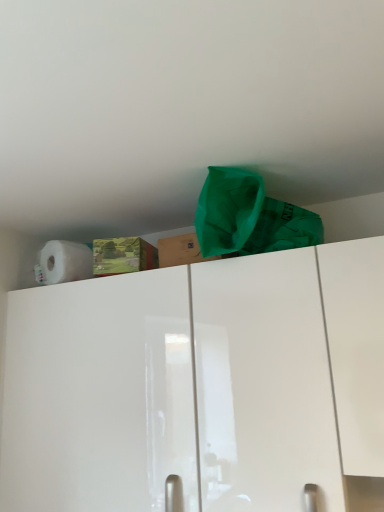
Locate an element on the screen. This screenshot has width=384, height=512. free space above green fabric bag at upper center (from a real-world perspective) is located at coordinates (261, 181).